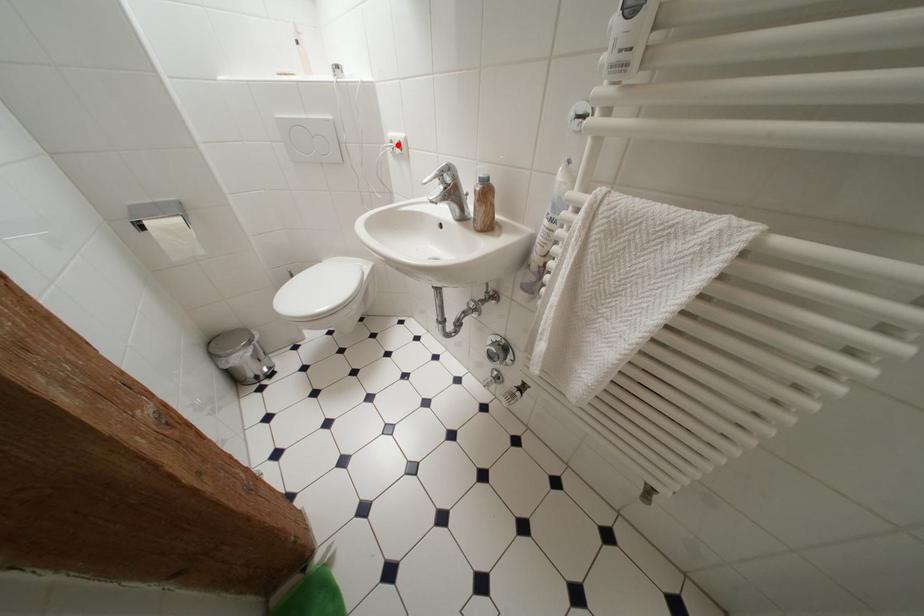
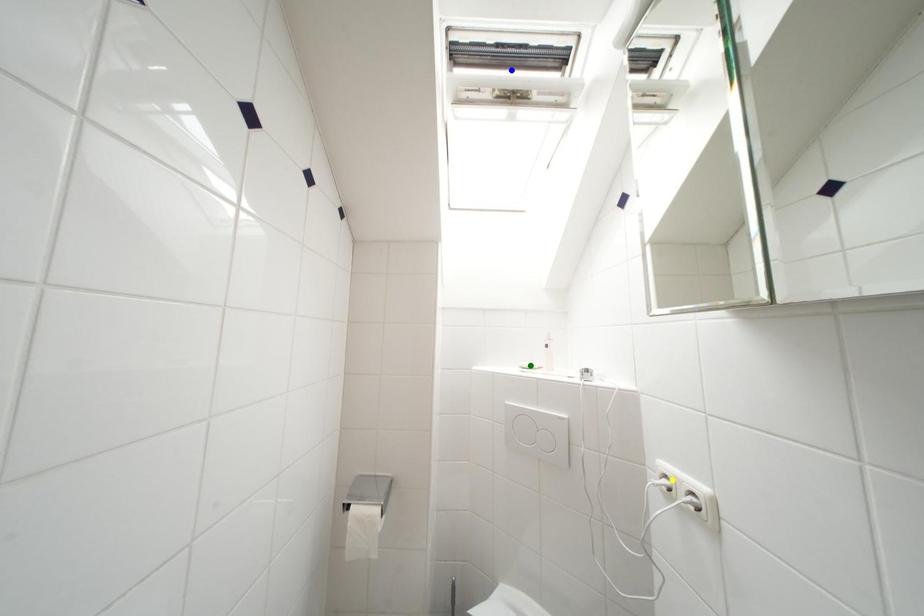
Question: I am providing you with two images of the same scene from different viewpoints. A red point is marked on the first image. You are given multiple points on the second image. In image 2, which mark is for the same physical point as the one in image 1?

Choices:
 (A) yellow point
 (B) blue point
 (C) green point

Answer: (A)